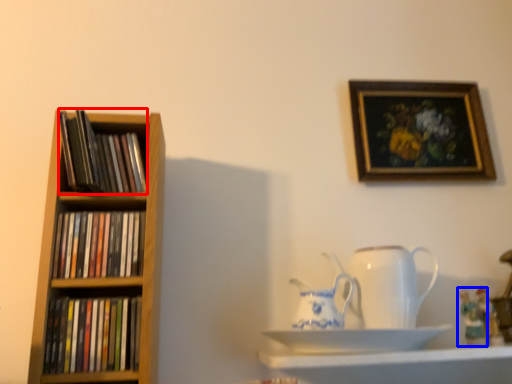
Question: Among these objects, which one is nearest to the camera, book (highlighted by a red box) or toy (highlighted by a blue box)?

Choices:
 (A) book
 (B) toy

Answer: (A)